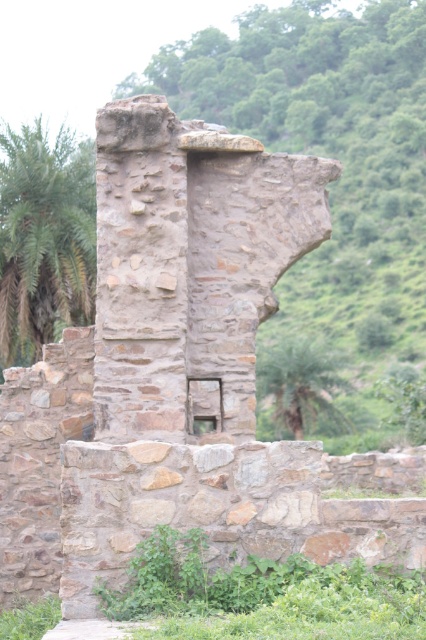
Is green leafy vegetation at lower center wider than green leafy palm tree at center?

No.

Does green leafy vegetation at lower center have a smaller size compared to green leafy palm tree at center?

Yes, green leafy vegetation at lower center is smaller than green leafy palm tree at center.

Describe the element at coordinates (261, 595) in the screenshot. The height and width of the screenshot is (640, 426). I see `green leafy vegetation at lower center` at that location.

Where is `green leafy vegetation at lower center`? This screenshot has height=640, width=426. green leafy vegetation at lower center is located at coordinates (261, 595).

Can you confirm if green leafy vegetation at lower center is positioned above green leafy palm tree at left?

Incorrect, green leafy vegetation at lower center is not positioned above green leafy palm tree at left.

Looking at this image, which is more to the right, green leafy vegetation at lower center or green leafy palm tree at left?

green leafy vegetation at lower center

What are the coordinates of `green leafy vegetation at lower center` in the screenshot? It's located at (261, 595).

At what (x,y) coordinates should I click in order to perform the action: click on green leafy vegetation at lower center. Please return your answer as a coordinate pair (x, y). This screenshot has width=426, height=640. Looking at the image, I should click on (261, 595).

Does green leafy palm tree at left appear on the left side of green leafy palm tree at center?

Indeed, green leafy palm tree at left is positioned on the left side of green leafy palm tree at center.

Is green leafy palm tree at left thinner than green leafy palm tree at center?

Yes.

At what (x,y) coordinates should I click in order to perform the action: click on green leafy palm tree at left. Please return your answer as a coordinate pair (x, y). This screenshot has height=640, width=426. Looking at the image, I should click on (43, 236).